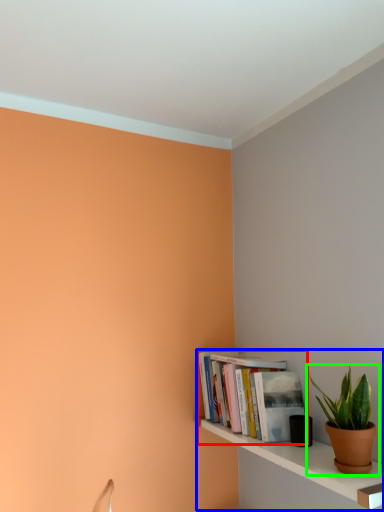
Question: Based on their relative distances, which object is farther from book (highlighted by a red box)? Choose from shelf (highlighted by a blue box) and houseplant (highlighted by a green box).

Choices:
 (A) shelf
 (B) houseplant

Answer: (B)